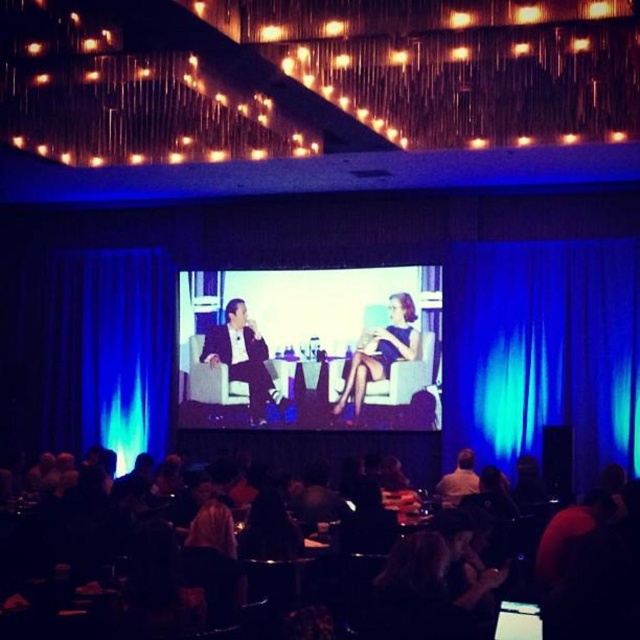
You are an event photographer positioned at the back of the room. You need to capture a photo of the satin black suit at center without the blue velvet curtain at left appearing in the frame. Is this possible given their positions?

The blue velvet curtain at left is above the satin black suit at center, so if you position your camera to aim directly at the satin black suit at center and avoid looking upward, you can capture the suit without the curtain in the frame.

You are an event planner arranging seating for a photo shoot in the described space. You need to place a tall podium between the satin black suit at center and the blue fabric dress at center. Which side of the podium should you position the taller object to ensure proper visibility for the camera? Please specify the side relative to the podium.

The satin black suit at center is much taller than the blue fabric dress at center. To ensure proper visibility, position the taller satin black suit at center on the side of the podium closer to the camera so that it doesn